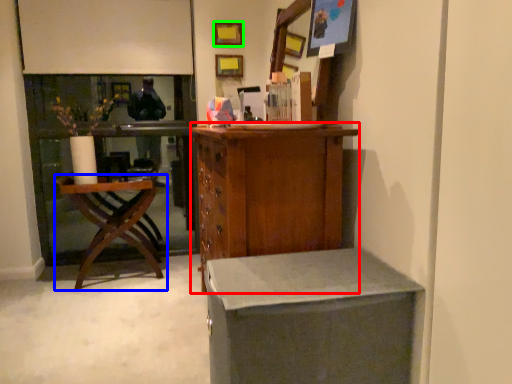
Question: Which is farther away from cabinetry (highlighted by a red box)? chair (highlighted by a blue box) or picture frame (highlighted by a green box)?

Choices:
 (A) chair
 (B) picture frame

Answer: (B)